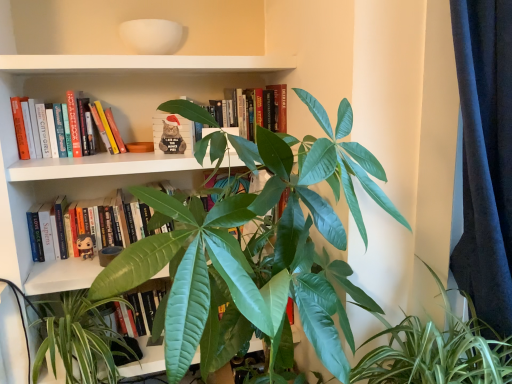
Locate an element on the screen. The height and width of the screenshot is (384, 512). green glossy leafy plant at center, which is the 1th houseplant in left-to-right order is located at coordinates (252, 248).

The width and height of the screenshot is (512, 384). What do you see at coordinates (82, 339) in the screenshot? I see `green glossy leaf at lower center` at bounding box center [82, 339].

This screenshot has height=384, width=512. What are the coordinates of `hardcover book at center, positioned as the 4th book in bottom-to-top order` in the screenshot? It's located at (257, 110).

Locate an element on the screen. green glossy leafy plant at center, which is the 1th houseplant in left-to-right order is located at coordinates [252, 248].

Is hardcover book at upper left, acting as the second book starting from the top, facing towards green glossy leafy plant at center, which is the 1th houseplant in left-to-right order?

No, hardcover book at upper left, acting as the second book starting from the top, is not aimed at green glossy leafy plant at center, which is the 1th houseplant in left-to-right order.

From the image's perspective, which is above, hardcover book at upper left, acting as the 3th book starting from the bottom, or green glossy leafy plant at center, which is the 1th houseplant in left-to-right order?

hardcover book at upper left, acting as the 3th book starting from the bottom, appears higher in the image.

Can you confirm if hardcover book at upper left, acting as the 3th book starting from the bottom, is bigger than green glossy leafy plant at center, which is the 1th houseplant in left-to-right order?

No, hardcover book at upper left, acting as the 3th book starting from the bottom, is not bigger than green glossy leafy plant at center, which is the 1th houseplant in left-to-right order.

Which is behind, hardcover book at upper left, acting as the second book starting from the top, or green glossy leafy plant at center, which is the 1th houseplant in left-to-right order?

hardcover book at upper left, acting as the second book starting from the top, is more distant.

What's the angular difference between santa hat plush cat at center, the second book from the bottom, and hardcover book at center, the 1th book in the bottom-to-top sequence,'s facing directions?

There is a 28.6-degree angle between the facing directions of santa hat plush cat at center, the second book from the bottom, and hardcover book at center, the 1th book in the bottom-to-top sequence.

Is santa hat plush cat at center, the 3th book when ordered from top to bottom, further to camera compared to hardcover book at center, the 1th book in the bottom-to-top sequence?

Yes.

From the picture: Considering the positions of objects santa hat plush cat at center, the 3th book when ordered from top to bottom, and hardcover book at center, which is the fourth book from top to bottom, in the image provided, who is more to the right, santa hat plush cat at center, the 3th book when ordered from top to bottom, or hardcover book at center, which is the fourth book from top to bottom,?

From the viewer's perspective, santa hat plush cat at center, the 3th book when ordered from top to bottom, appears more on the right side.

Does green glossy leafy plant at center, which is the 1th houseplant in left-to-right order, have a greater height compared to green glossy leaf at lower center?

Indeed, green glossy leafy plant at center, which is the 1th houseplant in left-to-right order, has a greater height compared to green glossy leaf at lower center.

Is green glossy leafy plant at center, which is the 1th houseplant in left-to-right order, thinner than green glossy leaf at lower center?

No, green glossy leafy plant at center, which is the 1th houseplant in left-to-right order, is not thinner than green glossy leaf at lower center.

From the image's perspective, is green glossy leafy plant at center, which is the 1th houseplant in left-to-right order, under green glossy leaf at lower center?

No, from the image's perspective, green glossy leafy plant at center, which is the 1th houseplant in left-to-right order, is not beneath green glossy leaf at lower center.

Is green glossy leafy plant at center, arranged as the 2th houseplant when viewed from the right, inside santa hat plush cat at center, the second book from the bottom?

That's incorrect, green glossy leafy plant at center, arranged as the 2th houseplant when viewed from the right, is not inside santa hat plush cat at center, the second book from the bottom.

From a real-world perspective, which object stands above the other?

From a 3D spatial view, santa hat plush cat at center, the 3th book when ordered from top to bottom, is above.

The width and height of the screenshot is (512, 384). Find the location of `the 1st houseplant below the santa hat plush cat at center, the 3th book when ordered from top to bottom (from a real-world perspective)`. the 1st houseplant below the santa hat plush cat at center, the 3th book when ordered from top to bottom (from a real-world perspective) is located at coordinates coord(252,248).

In terms of width, does santa hat plush cat at center, the 3th book when ordered from top to bottom, look wider or thinner when compared to green glossy leafy plant at center, arranged as the 2th houseplant when viewed from the right?

santa hat plush cat at center, the 3th book when ordered from top to bottom, is thinner than green glossy leafy plant at center, arranged as the 2th houseplant when viewed from the right.

How different are the orientations of hardcover book at center, which is the fourth book from top to bottom, and santa hat plush cat at center, the second book from the bottom, in degrees?

hardcover book at center, which is the fourth book from top to bottom, and santa hat plush cat at center, the second book from the bottom, are facing 28.6 degrees away from each other.

Choose the correct answer: Is hardcover book at center, the 1th book in the bottom-to-top sequence, inside santa hat plush cat at center, the 3th book when ordered from top to bottom, or outside it?

hardcover book at center, the 1th book in the bottom-to-top sequence, cannot be found inside santa hat plush cat at center, the 3th book when ordered from top to bottom.

Does hardcover book at center, the 1th book in the bottom-to-top sequence, appear on the left side of santa hat plush cat at center, the 3th book when ordered from top to bottom?

Indeed, hardcover book at center, the 1th book in the bottom-to-top sequence, is positioned on the left side of santa hat plush cat at center, the 3th book when ordered from top to bottom.

Is hardcover book at center, which is the fourth book from top to bottom, turned away from santa hat plush cat at center, the 3th book when ordered from top to bottom?

No, hardcover book at center, which is the fourth book from top to bottom, is not facing away from santa hat plush cat at center, the 3th book when ordered from top to bottom.

Is hardcover book at upper left, acting as the second book starting from the top, bigger than green glossy leaf at lower center?

No.

From a real-world perspective, between hardcover book at upper left, acting as the 3th book starting from the bottom, and green glossy leaf at lower center, who is vertically higher?

From a 3D spatial view, hardcover book at upper left, acting as the 3th book starting from the bottom, is above.

Is hardcover book at upper left, acting as the second book starting from the top, facing towards green glossy leaf at lower center?

No, hardcover book at upper left, acting as the second book starting from the top, does not turn towards green glossy leaf at lower center.

Based on the photo, does hardcover book at upper left, acting as the 3th book starting from the bottom, have a greater width compared to green glossy leaf at lower center?

In fact, hardcover book at upper left, acting as the 3th book starting from the bottom, might be narrower than green glossy leaf at lower center.

Is hardcover book at upper left, acting as the 3th book starting from the bottom, turned away from hardcover book at center, which is the fourth book from top to bottom?

No, hardcover book at center, which is the fourth book from top to bottom, is not at the back of hardcover book at upper left, acting as the 3th book starting from the bottom.

What's the angular difference between hardcover book at upper left, acting as the 3th book starting from the bottom, and hardcover book at center, which is the fourth book from top to bottom,'s facing directions?

1.99 degrees separate the facing orientations of hardcover book at upper left, acting as the 3th book starting from the bottom, and hardcover book at center, which is the fourth book from top to bottom.

Find the location of a particular element. This screenshot has height=384, width=512. book that appears on the left of hardcover book at center, the 1th book in the bottom-to-top sequence is located at coordinates (75, 121).

From the picture: Considering the positions of objects hardcover book at upper left, acting as the 3th book starting from the bottom, and hardcover book at center, which is the fourth book from top to bottom, in the image provided, who is behind, hardcover book at upper left, acting as the 3th book starting from the bottom, or hardcover book at center, which is the fourth book from top to bottom,?

Positioned behind is hardcover book at center, which is the fourth book from top to bottom.

Which book is the 4th one when counting from the left side of the green glossy leafy plant at center, arranged as the 2th houseplant when viewed from the right? Please provide its 2D coordinates.

[(75, 121)]

Locate an element on the screen. This screenshot has height=384, width=512. the 1st book above when counting from the hardcover book at center, the 1th book in the bottom-to-top sequence (from the image's perspective) is located at coordinates (173, 134).

Based on the photo, from the image, which object appears to be farther from green glossy leaf at lower center, hardcover book at center, the first book from the top, or hardcover book at upper left, acting as the second book starting from the top?

The object further to green glossy leaf at lower center is hardcover book at center, the first book from the top.

Estimate the real-world distances between objects in this image. Which object is closer to hardcover book at center, positioned as the 4th book in bottom-to-top order, green glossy leaf at lower center or hardcover book at center, the 1th book in the bottom-to-top sequence?

hardcover book at center, the 1th book in the bottom-to-top sequence, is closer to hardcover book at center, positioned as the 4th book in bottom-to-top order.

When comparing their distances from green glossy leaf at lower center, does green glossy leafy plant at center, the 1th houseplant in the right-to-left sequence, or hardcover book at center, the 1th book in the bottom-to-top sequence, seem closer?

Among the two, hardcover book at center, the 1th book in the bottom-to-top sequence, is located nearer to green glossy leaf at lower center.

Considering their positions, is green glossy leafy plant at center, which is the 1th houseplant in left-to-right order, positioned further to hardcover book at center, which is the fourth book from top to bottom, than santa hat plush cat at center, the second book from the bottom?

Among the two, green glossy leafy plant at center, which is the 1th houseplant in left-to-right order, is located further to hardcover book at center, which is the fourth book from top to bottom.

Looking at the image, which one is located closer to hardcover book at upper left, acting as the 3th book starting from the bottom, hardcover book at center, positioned as the 4th book in bottom-to-top order, or santa hat plush cat at center, the 3th book when ordered from top to bottom?

Among the two, santa hat plush cat at center, the 3th book when ordered from top to bottom, is located nearer to hardcover book at upper left, acting as the 3th book starting from the bottom.

Considering their positions, is hardcover book at upper left, acting as the 3th book starting from the bottom, positioned closer to santa hat plush cat at center, the second book from the bottom, than green glossy leaf at lower center?

The object closer to santa hat plush cat at center, the second book from the bottom, is hardcover book at upper left, acting as the 3th book starting from the bottom.

Estimate the real-world distances between objects in this image. Which object is closer to green glossy leafy plant at center, the 1th houseplant in the right-to-left sequence, hardcover book at center, the first book from the top, or hardcover book at upper left, acting as the second book starting from the top?

hardcover book at center, the first book from the top.

Which object lies nearer to the anchor point green glossy leafy plant at center, positioned as the 2th houseplant in left-to-right order, hardcover book at center, the first book from the top, or green glossy leaf at lower center?

The object closer to green glossy leafy plant at center, positioned as the 2th houseplant in left-to-right order, is hardcover book at center, the first book from the top.

What are the coordinates of `houseplant located between green glossy leaf at lower center and green glossy leafy plant at center, the 1th houseplant in the right-to-left sequence, in the left-right direction` in the screenshot? It's located at (252, 248).

This screenshot has height=384, width=512. I want to click on houseplant between hardcover book at upper left, acting as the 3th book starting from the bottom, and green glossy leafy plant at center, positioned as the 2th houseplant in left-to-right order, so click(252, 248).

Where is `book between green glossy leafy plant at center, which is the 1th houseplant in left-to-right order, and hardcover book at center, which is the fourth book from top to bottom, in the front-back direction`? book between green glossy leafy plant at center, which is the 1th houseplant in left-to-right order, and hardcover book at center, which is the fourth book from top to bottom, in the front-back direction is located at coordinates (75, 121).

Where is `vegetation between green glossy leafy plant at center, which is the 1th houseplant in left-to-right order, and hardcover book at center, which is the fourth book from top to bottom, in the front-back direction`? The width and height of the screenshot is (512, 384). vegetation between green glossy leafy plant at center, which is the 1th houseplant in left-to-right order, and hardcover book at center, which is the fourth book from top to bottom, in the front-back direction is located at coordinates (82, 339).